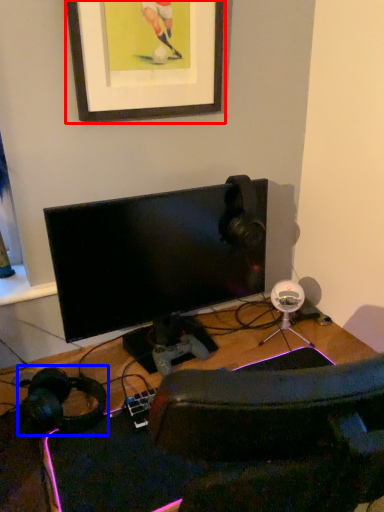
Question: Among these objects, which one is farthest to the camera, picture frame (highlighted by a red box) or headphones (highlighted by a blue box)?

Choices:
 (A) picture frame
 (B) headphones

Answer: (A)